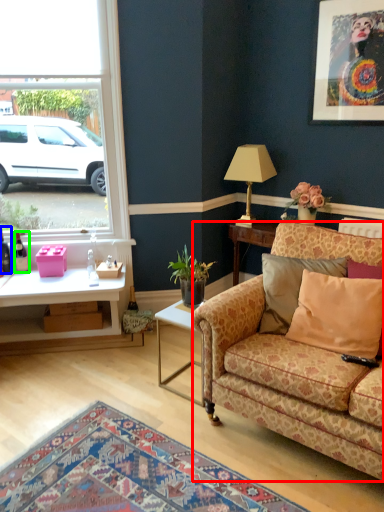
Question: Estimate the real-world distances between objects in this image. Which object is farther from studio couch (highlighted by a red box), bottle (highlighted by a blue box) or bottle (highlighted by a green box)?

Choices:
 (A) bottle
 (B) bottle

Answer: (A)